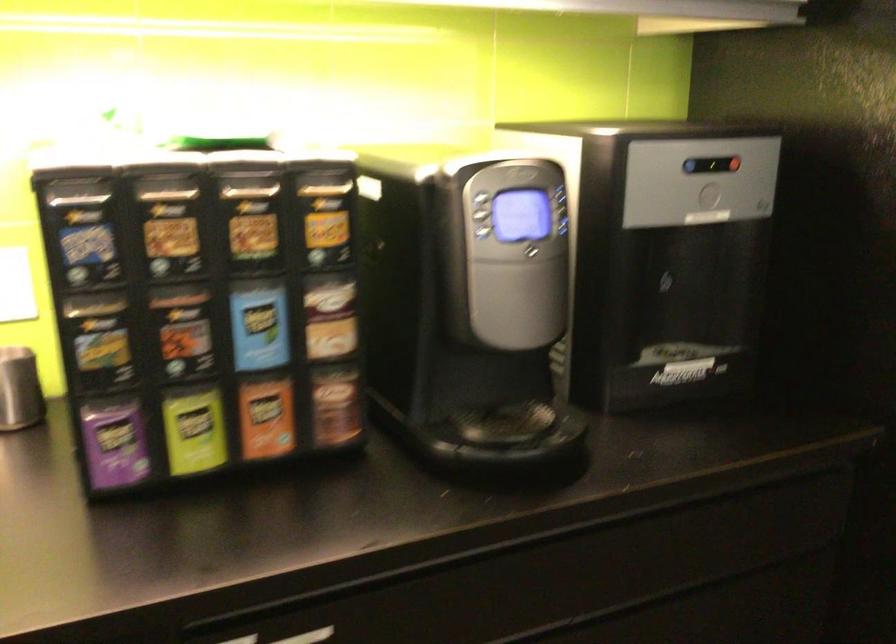
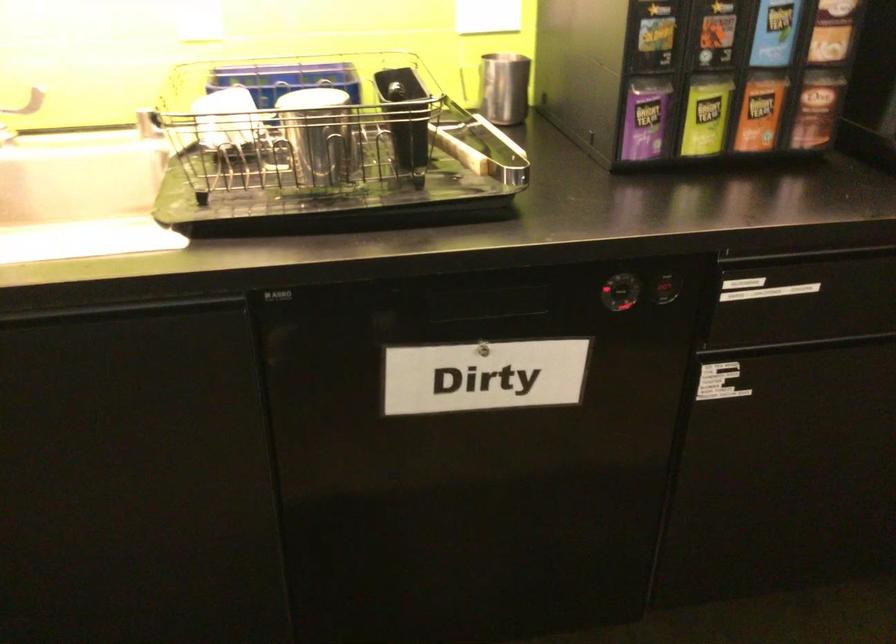
The point at (194, 430) is marked in the first image. Where is the corresponding point in the second image?

(705, 116)